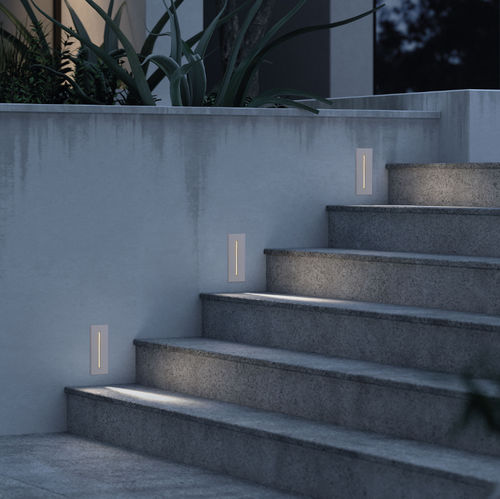
You are a GUI agent. You are given a task and a screenshot of the screen. Output one action in this format:
    pyautogui.click(x=<x>, y=<y>)
    Task: Click on the wall
    The image size is (500, 499).
    Given the screenshot: What is the action you would take?
    pyautogui.click(x=122, y=198)